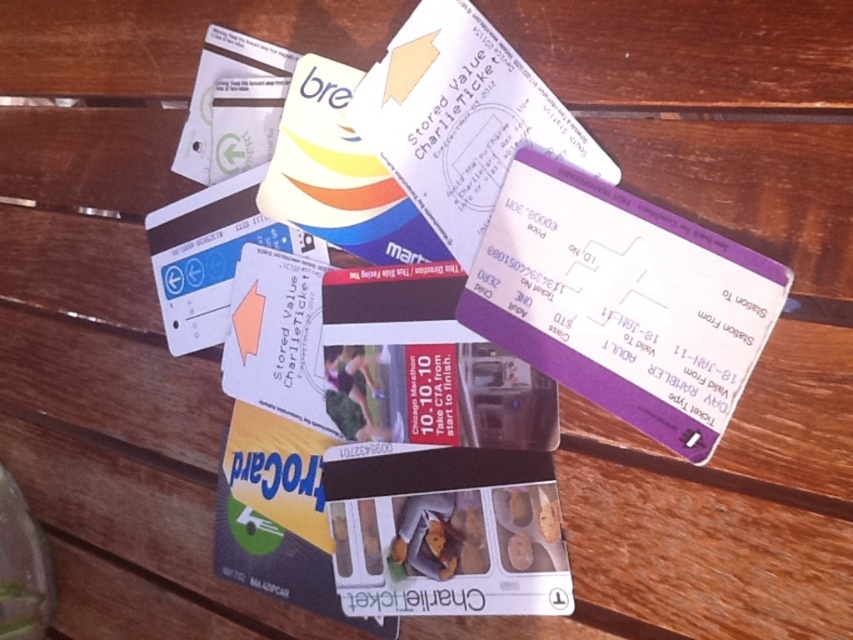
Question: Among these points, which one is nearest to the camera?

Choices:
 (A) (444, 60)
 (B) (628, 262)

Answer: (B)

Question: In this image, where is purple card at upper right located relative to transparent plastic ticket at center?

Choices:
 (A) left
 (B) right

Answer: (B)

Question: Can you confirm if purple card at upper right is positioned below transparent plastic ticket at center?

Choices:
 (A) yes
 (B) no

Answer: (A)

Question: Is purple card at upper right to the left of transparent plastic ticket at center from the viewer's perspective?

Choices:
 (A) no
 (B) yes

Answer: (A)

Question: Which point is farther to the camera?

Choices:
 (A) (456, 168)
 (B) (517, 244)

Answer: (A)